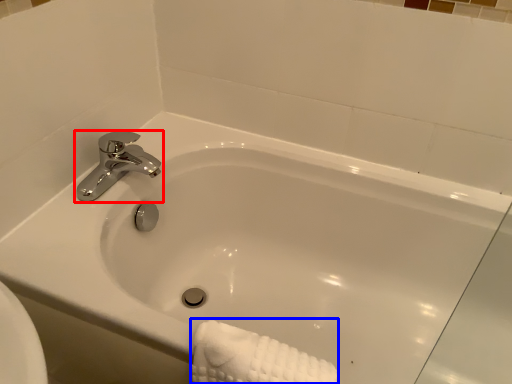
Question: Which object appears closest to the camera in this image, tap (highlighted by a red box) or bath towel (highlighted by a blue box)?

Choices:
 (A) tap
 (B) bath towel

Answer: (B)